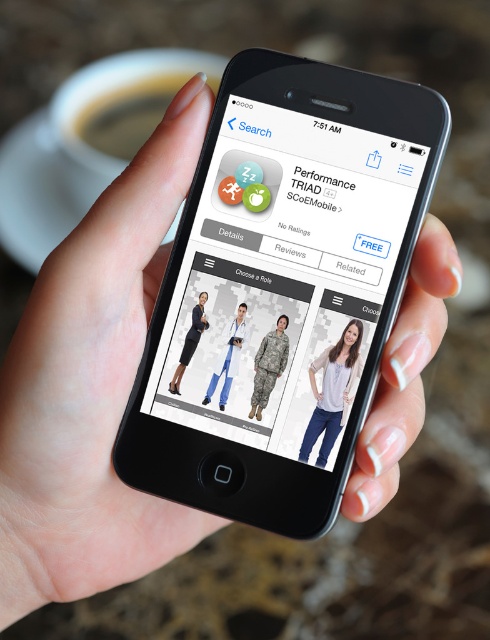
You are looking at the app screen of Performance TRIAD. There is a point at coordinates (x=333, y=392). What is the object located at this point?

The point at coordinates (x=333, y=392) corresponds to the light gray cotton shirt at center.